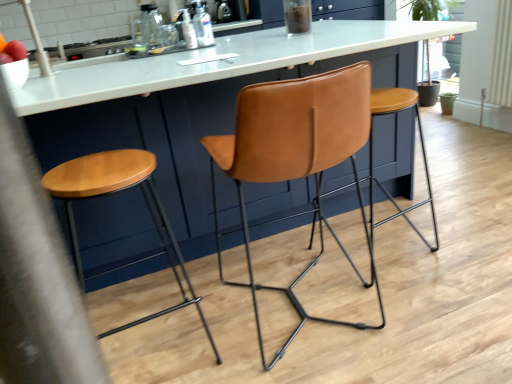
Locate an element on the screen. This screenshot has width=512, height=384. vacant space underneath leather stool at center, acting as the second stool starting from the left (from a real-world perspective) is located at coordinates (394, 258).